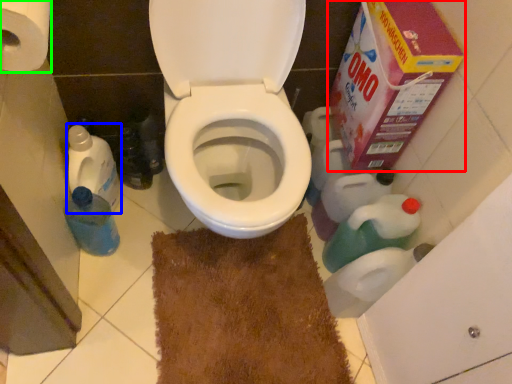
Question: Which is nearer to the cardboard box (highlighted by a red box)? cleaning product (highlighted by a blue box) or toilet paper (highlighted by a green box).

Choices:
 (A) cleaning product
 (B) toilet paper

Answer: (B)